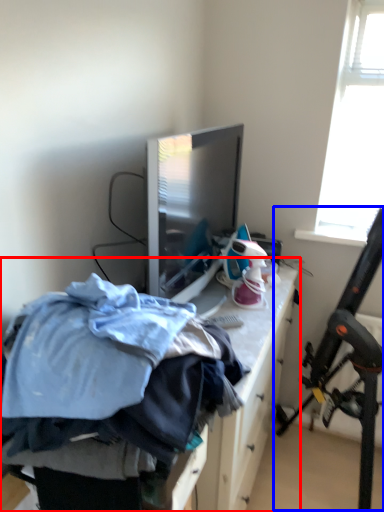
Question: Which object is further to the camera taking this photo, furniture (highlighted by a red box) or folding chair (highlighted by a blue box)?

Choices:
 (A) furniture
 (B) folding chair

Answer: (B)